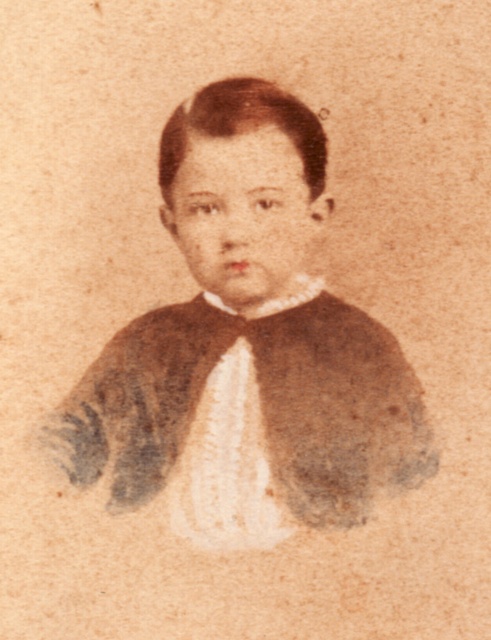
Is brown textured sweater at center in front of white textured bow tie at center?

Yes, brown textured sweater at center is in front of white textured bow tie at center.

Who is more forward, (215, 102) or (247, 352)?

Point (215, 102) is in front.

Find the location of a particular element. This screenshot has height=640, width=491. brown textured sweater at center is located at coordinates (248, 348).